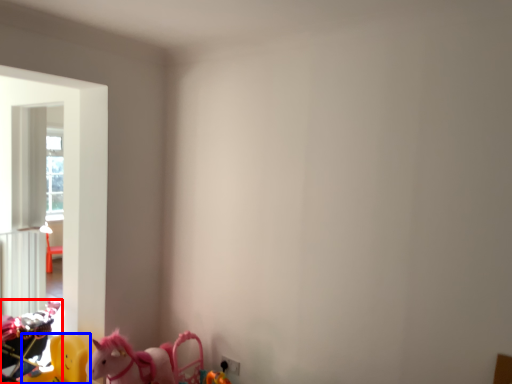
Question: Among these objects, which one is farthest to the camera, toy (highlighted by a red box) or toy (highlighted by a blue box)?

Choices:
 (A) toy
 (B) toy

Answer: (A)